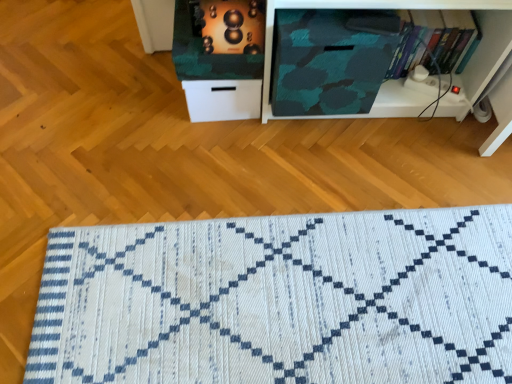
What do you see at coordinates (220, 60) in the screenshot? I see `camouflage fabric cabinet at center` at bounding box center [220, 60].

Where is `camouflage fabric at center`? camouflage fabric at center is located at coordinates tap(402, 81).

What do you see at coordinates (231, 26) in the screenshot?
I see `metallic gold speaker at upper center` at bounding box center [231, 26].

Find the location of a particular element. The image size is (512, 384). camouflage fabric cabinet at center is located at coordinates (220, 60).

Considering the positions of objects camouflage fabric at center and hardcover book at upper right in the image provided, who is in front, camouflage fabric at center or hardcover book at upper right?

camouflage fabric at center is in front.

Consider the image. Is camouflage fabric at center spatially inside hardcover book at upper right, or outside of it?

camouflage fabric at center is spatially situated outside hardcover book at upper right.

Can you confirm if camouflage fabric at center is shorter than hardcover book at upper right?

In fact, camouflage fabric at center may be taller than hardcover book at upper right.

From the image's perspective, which is above, camouflage fabric at center or hardcover book at upper right?

hardcover book at upper right.

Is camouflage fabric cabinet at center bigger than camouflage fabric at center?

Indeed, camouflage fabric cabinet at center has a larger size compared to camouflage fabric at center.

I want to click on cabinetry lying above the camouflage fabric at center (from the image's perspective), so click(220, 60).

Can you confirm if camouflage fabric cabinet at center is positioned to the right of camouflage fabric at center?

In fact, camouflage fabric cabinet at center is to the left of camouflage fabric at center.

From the image's perspective, does camouflage fabric cabinet at center appear higher than camouflage fabric at center?

Correct, camouflage fabric cabinet at center appears higher than camouflage fabric at center in the image.

Is camouflage fabric at center at the left side of white woven mat at lower center?

In fact, camouflage fabric at center is to the right of white woven mat at lower center.

Is camouflage fabric at center looking in the opposite direction of white woven mat at lower center?

No, white woven mat at lower center is not at the back of camouflage fabric at center.

Looking at this image, from the image's perspective, who appears lower, camouflage fabric at center or white woven mat at lower center?

From the image's view, white woven mat at lower center is below.

Is camouflage fabric at center situated inside white woven mat at lower center or outside?

camouflage fabric at center is outside white woven mat at lower center.

In the image, is camouflage fabric at center positioned in front of or behind camouflage fabric cabinet at center?

Clearly, camouflage fabric at center is in front of camouflage fabric cabinet at center.

Would you say camouflage fabric at center is to the left or to the right of camouflage fabric cabinet at center in the picture?

In the image, camouflage fabric at center appears on the right side of camouflage fabric cabinet at center.

This screenshot has height=384, width=512. In order to click on cabinetry behind the camouflage fabric at center in this screenshot , I will do `click(220, 60)`.

Is camouflage fabric at center aimed at camouflage fabric cabinet at center?

No, camouflage fabric at center is not oriented towards camouflage fabric cabinet at center.

Is camouflage fabric cabinet at center facing away from metallic gold speaker at upper center?

No, metallic gold speaker at upper center is not at the back of camouflage fabric cabinet at center.

Based on the photo, from the image's perspective, is camouflage fabric cabinet at center below metallic gold speaker at upper center?

Yes, from the image's perspective, camouflage fabric cabinet at center is beneath metallic gold speaker at upper center.

How different are the orientations of camouflage fabric cabinet at center and metallic gold speaker at upper center in degrees?

2.08 degrees separate the facing orientations of camouflage fabric cabinet at center and metallic gold speaker at upper center.

Considering the sizes of camouflage fabric cabinet at center and metallic gold speaker at upper center in the image, is camouflage fabric cabinet at center taller or shorter than metallic gold speaker at upper center?

camouflage fabric cabinet at center is taller than metallic gold speaker at upper center.

From a real-world perspective, which object stands above the other?

In real-world perspective, metallic gold speaker at upper center is above.

Which object is closer to the camera taking this photo, metallic gold speaker at upper center or white woven mat at lower center?

white woven mat at lower center.

Measure the distance from metallic gold speaker at upper center to white woven mat at lower center.

72.33 centimeters.

Can you confirm if metallic gold speaker at upper center is taller than white woven mat at lower center?

Yes, metallic gold speaker at upper center is taller than white woven mat at lower center.

Is white woven mat at lower center aimed at camouflage fabric at center?

No, white woven mat at lower center is not oriented towards camouflage fabric at center.

Is white woven mat at lower center closer to the viewer compared to camouflage fabric at center?

Yes, white woven mat at lower center is in front of camouflage fabric at center.

Which of these two, white woven mat at lower center or camouflage fabric at center, is smaller?

With smaller size is camouflage fabric at center.

The height and width of the screenshot is (384, 512). I want to click on book located underneath the camouflage fabric at center (from a real-world perspective), so click(434, 41).

Image resolution: width=512 pixels, height=384 pixels. What are the coordinates of `shelf that is on the right side of camouflage fabric cabinet at center` in the screenshot? It's located at point(402,81).

Considering their positions, is camouflage fabric at center positioned closer to white woven mat at lower center than hardcover book at upper right?

camouflage fabric at center is positioned closer to the anchor white woven mat at lower center.

From the image, which object appears to be farther from hardcover book at upper right, metallic gold speaker at upper center or camouflage fabric cabinet at center?

camouflage fabric cabinet at center is positioned further to the anchor hardcover book at upper right.

Considering their positions, is camouflage fabric at center positioned closer to metallic gold speaker at upper center than camouflage fabric cabinet at center?

camouflage fabric cabinet at center is positioned closer to the anchor metallic gold speaker at upper center.

From the image, which object appears to be nearer to camouflage fabric cabinet at center, camouflage fabric at center or white woven mat at lower center?

Among the two, camouflage fabric at center is located nearer to camouflage fabric cabinet at center.

Looking at the image, which one is located closer to hardcover book at upper right, metallic gold speaker at upper center or camouflage fabric at center?

The object closer to hardcover book at upper right is camouflage fabric at center.

In the scene shown: From the image, which object appears to be nearer to camouflage fabric cabinet at center, metallic gold speaker at upper center or hardcover book at upper right?

metallic gold speaker at upper center.

Looking at the image, which one is located further to hardcover book at upper right, camouflage fabric at center or metallic gold speaker at upper center?

metallic gold speaker at upper center.

Looking at the image, which one is located closer to metallic gold speaker at upper center, camouflage fabric at center or white woven mat at lower center?

Based on the image, camouflage fabric at center appears to be nearer to metallic gold speaker at upper center.

What are the coordinates of `book between metallic gold speaker at upper center and white woven mat at lower center from top to bottom` in the screenshot? It's located at (434, 41).

At what (x,y) coordinates should I click in order to perform the action: click on shelf between metallic gold speaker at upper center and white woven mat at lower center from top to bottom. Please return your answer as a coordinate pair (x, y). Looking at the image, I should click on point(402,81).

Find the location of `appliance situated between camouflage fabric cabinet at center and hardcover book at upper right from left to right`. appliance situated between camouflage fabric cabinet at center and hardcover book at upper right from left to right is located at coordinates (231, 26).

The width and height of the screenshot is (512, 384). What are the coordinates of `cabinetry between metallic gold speaker at upper center and white woven mat at lower center vertically` in the screenshot? It's located at (220, 60).